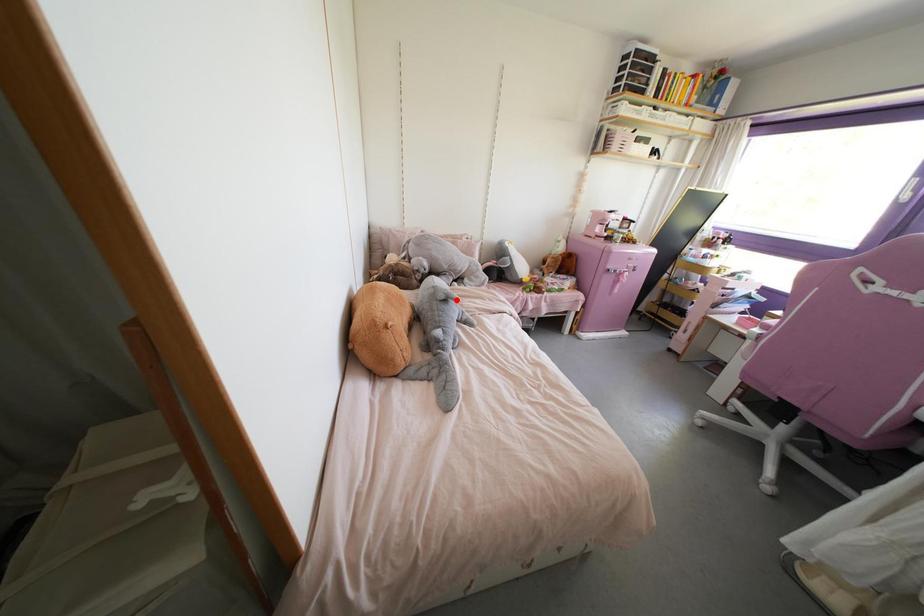
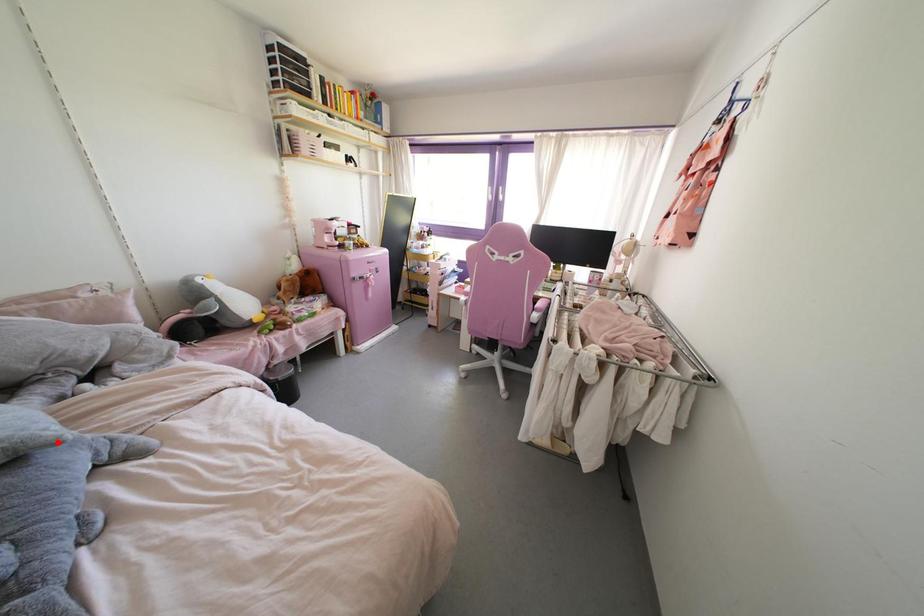
I am providing you with two images of the same scene from different viewpoints. A red point is marked on the first image and another point is marked on the second image. Are the points marked in image1 and image2 representing the same 3D position?

Yes